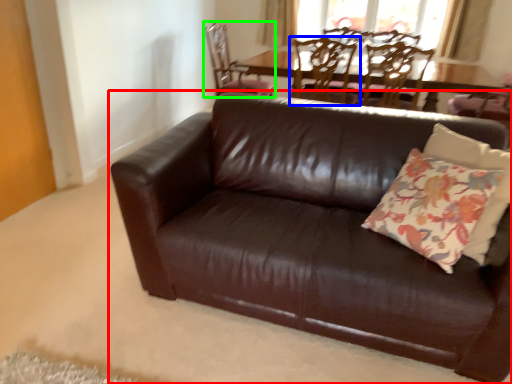
Question: Based on their relative distances, which object is farther from studio couch (highlighted by a red box)? Choose from chair (highlighted by a blue box) and chair (highlighted by a green box).

Choices:
 (A) chair
 (B) chair

Answer: (B)